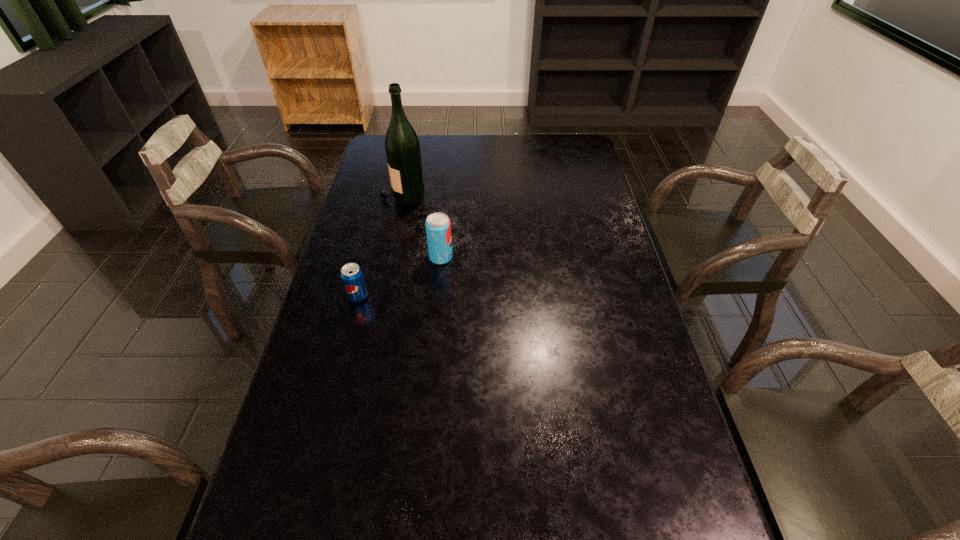
Where is `the tallest object`? the tallest object is located at coordinates (402, 147).

Where is `wine bottle`? wine bottle is located at coordinates (x=402, y=147).

This screenshot has width=960, height=540. Identify the location of the farther pop soda. (438, 227).

You are a GUI agent. You are given a task and a screenshot of the screen. Output one action in this format:
    pyautogui.click(x=<x>, y=<y>)
    Task: Click on the second farthest object
    Image resolution: width=960 pixels, height=540 pixels.
    Given the screenshot: What is the action you would take?
    pyautogui.click(x=438, y=227)

This screenshot has width=960, height=540. Identify the location of the shortest object. 351,274.

This screenshot has width=960, height=540. In order to click on the nearest object in this screenshot , I will do `click(351, 274)`.

Where is `vacant space located on the back of the wine bottle`? vacant space located on the back of the wine bottle is located at coordinates (409, 167).

Locate an element on the screen. The width and height of the screenshot is (960, 540). free space located on the front of the second farthest object is located at coordinates (432, 359).

Locate an element on the screen. Image resolution: width=960 pixels, height=540 pixels. vacant space located on the back of the left pop soda is located at coordinates (369, 256).

Where is `wine bottle that is positioned at the left edge`? This screenshot has width=960, height=540. wine bottle that is positioned at the left edge is located at coordinates (402, 147).